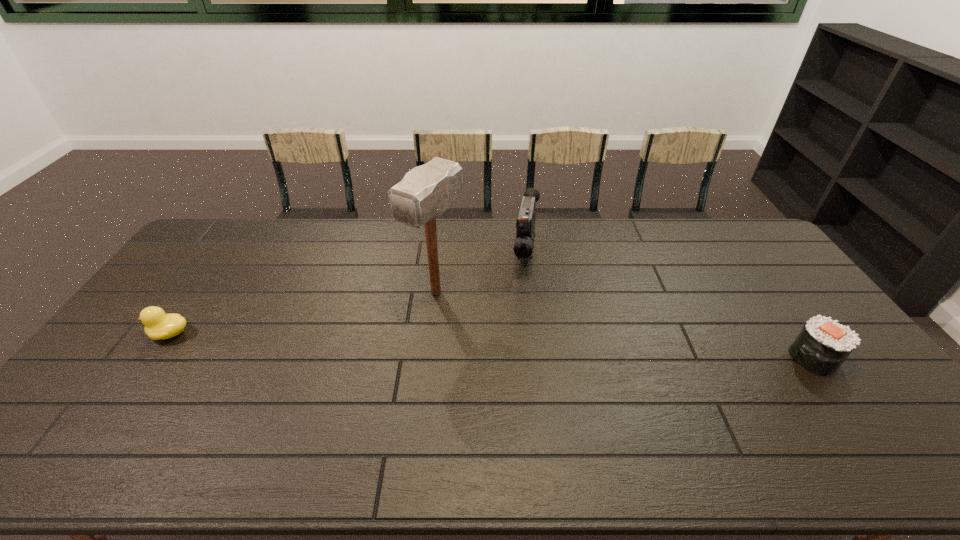
Locate an element on the screen. Image resolution: width=960 pixels, height=540 pixels. vacant space that's between the leftmost object and the mallet is located at coordinates (303, 313).

Find the location of a particular element. object identified as the second closest to the second object from left to right is located at coordinates (158, 325).

Locate which object is the third closest to the mallet. Please provide its 2D coordinates. Your answer should be formatted as a tuple, i.e. [(x, y)], where the tuple contains the x and y coordinates of a point satisfying the conditions above.

[(822, 345)]

What are the coordinates of `blank space that satisfies the following two spatial constraints: 1. on the front side of the rightmost object; 2. on the right side of the mallet` in the screenshot? It's located at (429, 357).

Find the location of `blank space that satisfies the following two spatial constraints: 1. on the front side of the second tallest object; 2. on the right side of the sushi`. blank space that satisfies the following two spatial constraints: 1. on the front side of the second tallest object; 2. on the right side of the sushi is located at coordinates (539, 357).

Find the location of a particular element. The height and width of the screenshot is (540, 960). vacant point that satisfies the following two spatial constraints: 1. on the front side of the sushi; 2. on the right side of the second object from left to right is located at coordinates (429, 357).